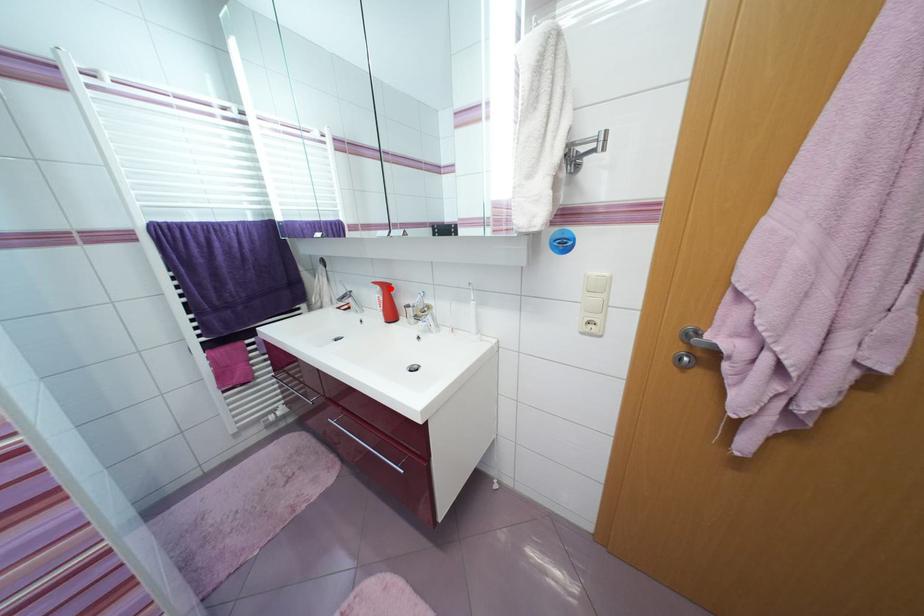
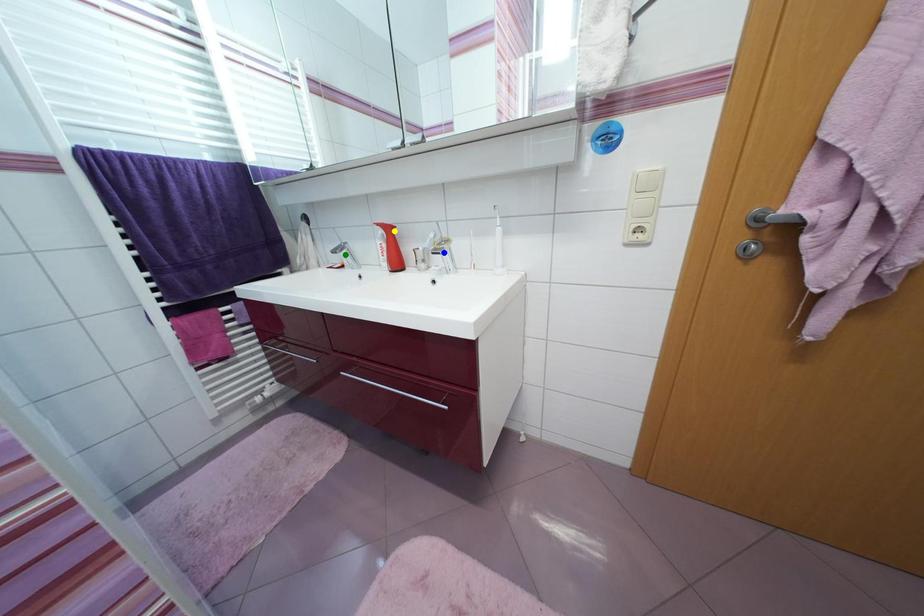
Question: I am providing you with two images of the same scene from different viewpoints. A red point is marked on the first image. You are given multiple points on the second image. Which mark in image 2 goes with the point in image 1?

Choices:
 (A) green point
 (B) blue point
 (C) yellow point

Answer: (C)